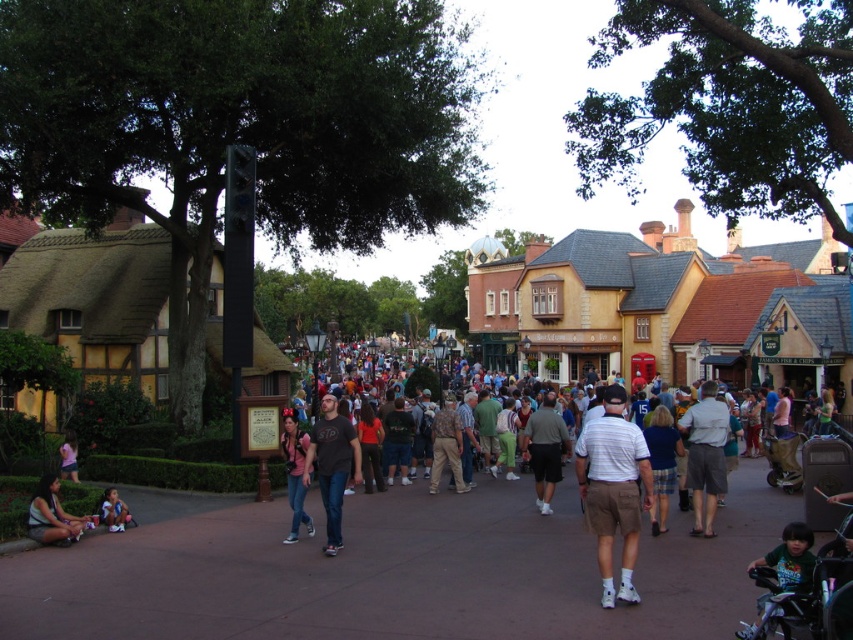
In the scene shown: Who is shorter, dark gray shirt at center or matte black shorts at lower left?

With less height is matte black shorts at lower left.

Is dark gray shirt at center bigger than matte black shorts at lower left?

Yes, dark gray shirt at center is bigger than matte black shorts at lower left.

Find the location of a particular element. The width and height of the screenshot is (853, 640). dark gray shirt at center is located at coordinates (544, 449).

Is light brown shorts at center shorter than light pink fabric dress at lower left?

Incorrect, light brown shorts at center's height does not fall short of light pink fabric dress at lower left's.

Does light brown shorts at center appear on the right side of light pink fabric dress at lower left?

Indeed, light brown shorts at center is positioned on the right side of light pink fabric dress at lower left.

Find the location of a particular element. This screenshot has width=853, height=640. light brown shorts at center is located at coordinates (705, 456).

Does light brown shorts at center lie in front of denim jeans at center?

That is True.

Is light brown shorts at center taller than denim jeans at center?

Indeed, light brown shorts at center has a greater height compared to denim jeans at center.

Is point (691, 442) positioned behind point (294, 497)?

Yes, it is behind point (294, 497).

You are a GUI agent. You are given a task and a screenshot of the screen. Output one action in this format:
    pyautogui.click(x=<x>, y=<y>)
    Task: Click on the light brown shorts at center
    
    Given the screenshot: What is the action you would take?
    click(x=705, y=456)